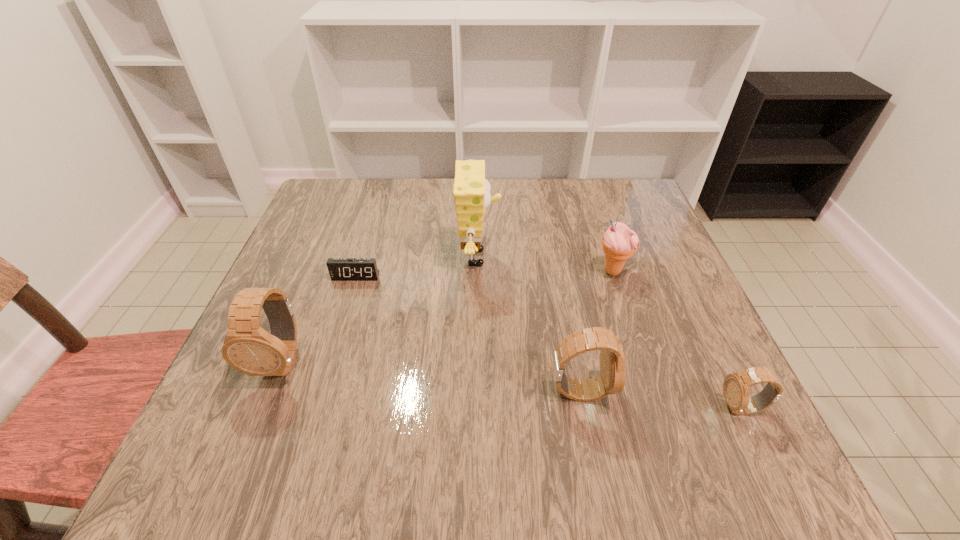
Image resolution: width=960 pixels, height=540 pixels. What are the coordinates of `watch positioned at the right edge` in the screenshot? It's located at (736, 387).

Find the location of a particular element. icecream at the right edge is located at coordinates (619, 243).

This screenshot has width=960, height=540. Identify the location of object that is at the near left corner. (247, 347).

The height and width of the screenshot is (540, 960). What are the coordinates of `object present at the near right corner` in the screenshot? It's located at coord(736,387).

Find the location of a particular element. The image size is (960, 540). vacant space at the far edge of the desktop is located at coordinates (574, 226).

Find the location of a particular element. The width and height of the screenshot is (960, 540). blank space at the near edge of the desktop is located at coordinates (411, 422).

Where is `vacant space at the left edge`? vacant space at the left edge is located at coordinates (323, 243).

This screenshot has width=960, height=540. I want to click on vacant area at the right edge, so click(675, 320).

Locate an element on the screen. Image resolution: width=960 pixels, height=540 pixels. vacant space at the far right corner of the desktop is located at coordinates (595, 194).

Locate an element on the screen. vacant area at the near right corner is located at coordinates (713, 392).